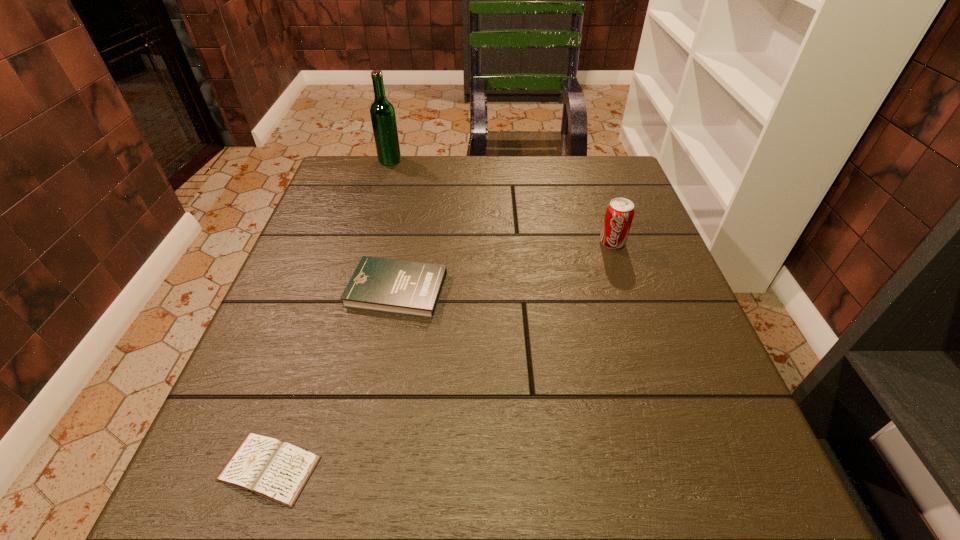
Locate an element on the screen. This screenshot has width=960, height=540. beer bottle is located at coordinates (382, 113).

Where is `the tallest object`? the tallest object is located at coordinates (382, 113).

You are a GUI agent. You are given a task and a screenshot of the screen. Output one action in this format:
    pyautogui.click(x=<x>, y=<y>)
    Task: Click on the soda can
    Image resolution: width=960 pixels, height=540 pixels.
    Given the screenshot: What is the action you would take?
    pyautogui.click(x=619, y=214)

Find the location of a particular element. This screenshot has height=540, width=960. the rightmost object is located at coordinates (619, 214).

You are a GUI agent. You are given a task and a screenshot of the screen. Output one action in this format:
    pyautogui.click(x=<x>, y=<y>)
    Task: Click on the book
    
    Given the screenshot: What is the action you would take?
    pyautogui.click(x=403, y=287)

I want to click on the third farthest object, so click(403, 287).

Where is `diary`? The image size is (960, 540). diary is located at coordinates pyautogui.click(x=265, y=466).

The image size is (960, 540). Find the location of `the shortest object`. the shortest object is located at coordinates (265, 466).

Locate an element on the screen. This screenshot has width=960, height=540. vacant space situated on the right of the farthest object is located at coordinates (522, 160).

Locate an element on the screen. The height and width of the screenshot is (540, 960). free location located on the back of the soda can is located at coordinates (589, 173).